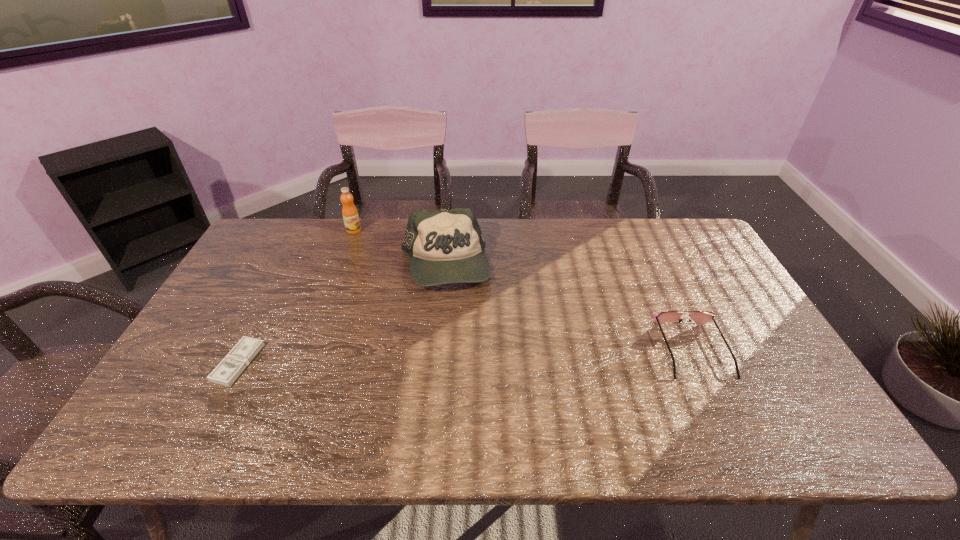
The image size is (960, 540). I want to click on object that is at the left edge, so click(x=228, y=370).

Find the location of a particular element. object located in the right edge section of the desktop is located at coordinates (x=699, y=317).

Identify the location of object present at the near left corner. The height and width of the screenshot is (540, 960). (228, 370).

The image size is (960, 540). In order to click on object present at the near right corner in this screenshot , I will do `click(699, 317)`.

Locate an element on the screen. This screenshot has width=960, height=540. vacant space at the far edge of the desktop is located at coordinates (501, 230).

Locate an element on the screen. The width and height of the screenshot is (960, 540). free spot at the near edge of the desktop is located at coordinates (405, 380).

In the image, there is a desktop. At what (x,y) coordinates should I click in order to perform the action: click on vacant space at the left edge. Please return your answer as a coordinate pair (x, y). Looking at the image, I should click on (220, 332).

Identify the location of free location at the right edge of the desktop. Image resolution: width=960 pixels, height=540 pixels. (751, 352).

Locate an element on the screen. vacant space at the far left corner of the desktop is located at coordinates (257, 246).

In the image, there is a desktop. Where is `free region at the far right corner`? free region at the far right corner is located at coordinates (662, 240).